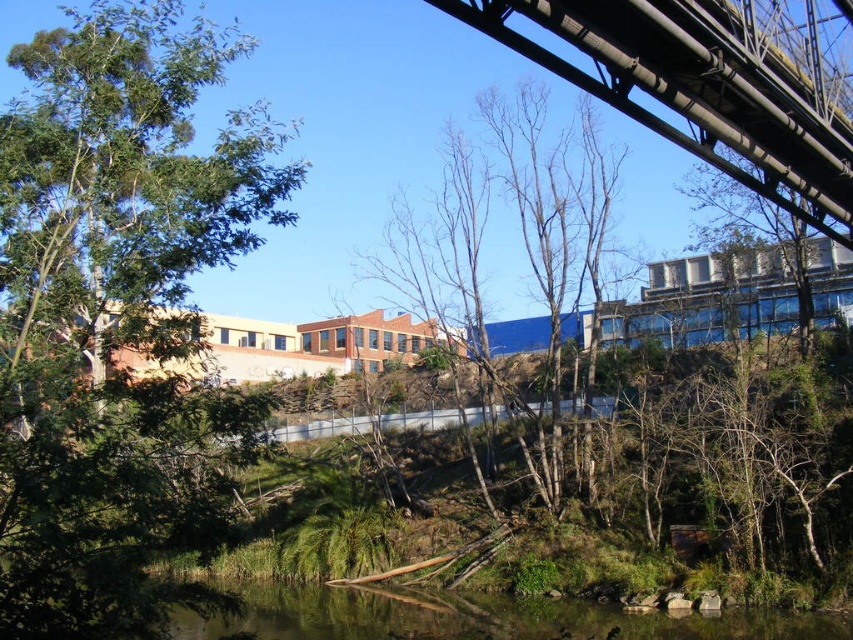
You are standing at the edge of the clear water at lower center and looking towards the bare branches at center. Which object is closer to you?

The clear water at lower center is closer to you because it is shorter than the bare branches at center, meaning the branches are further away.

From the picture: What are the coordinates of the green leafy tree at upper left in the image?

The coordinates of the green leafy tree at upper left are at point (115, 310).